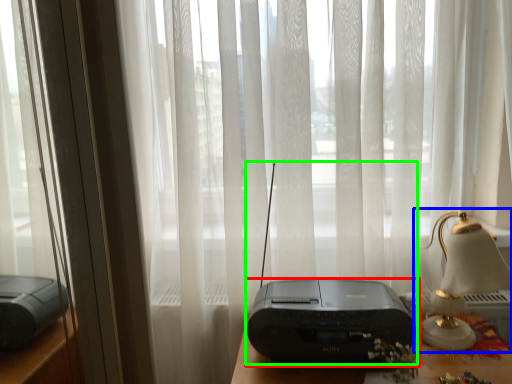
Question: Considering the real-world distances, which object is farthest from printer (highlighted by a red box)? bedside lamp (highlighted by a blue box) or gadget (highlighted by a green box)?

Choices:
 (A) bedside lamp
 (B) gadget

Answer: (A)